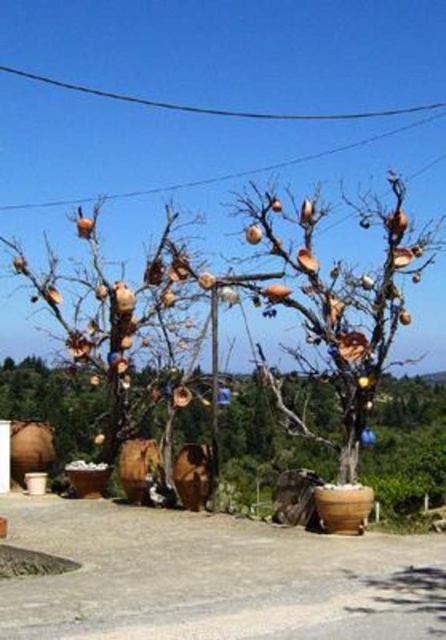
Question: Does matte brown tree at left have a greater width compared to black wire at upper center?

Choices:
 (A) no
 (B) yes

Answer: (A)

Question: Is matte brown tree at left smaller than matte ceramic tree at center?

Choices:
 (A) yes
 (B) no

Answer: (B)

Question: Which object is closer to the camera taking this photo?

Choices:
 (A) matte brown tree at left
 (B) matte ceramic tree at center
 (C) black wire at upper center

Answer: (B)

Question: Which is farther from the matte brown tree at left?

Choices:
 (A) black wire at upper center
 (B) matte ceramic tree at center

Answer: (A)

Question: Does matte brown tree at left have a lesser width compared to black wire at upper center?

Choices:
 (A) yes
 (B) no

Answer: (A)

Question: Among these objects, which one is nearest to the camera?

Choices:
 (A) matte ceramic tree at center
 (B) matte brown tree at left

Answer: (A)